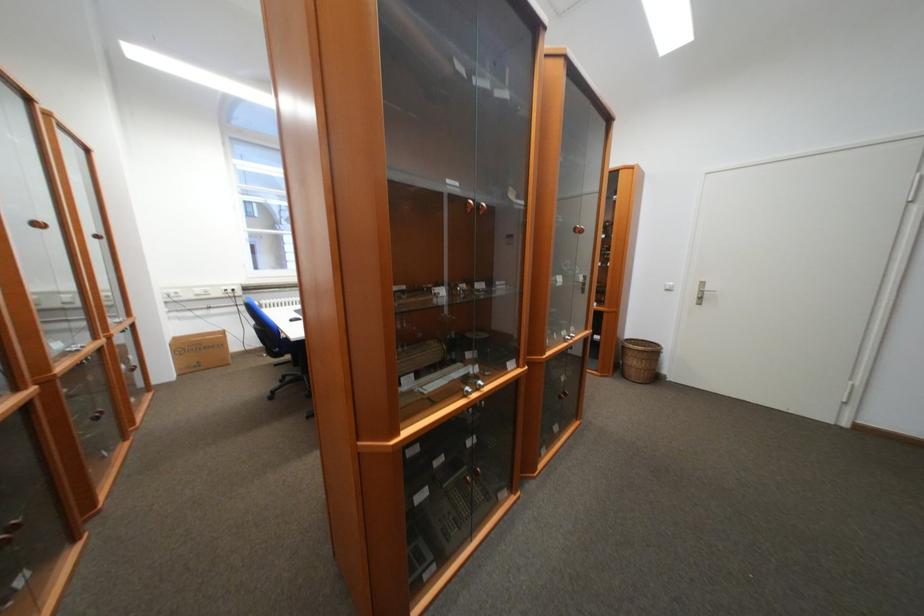
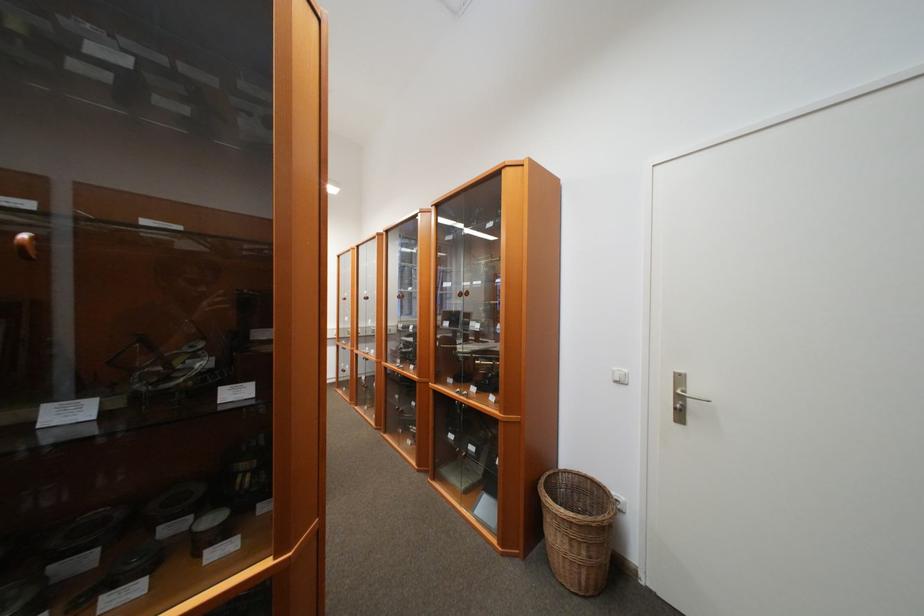
In the second image, find the point that corresponds to (x=676, y=291) in the first image.

(626, 383)